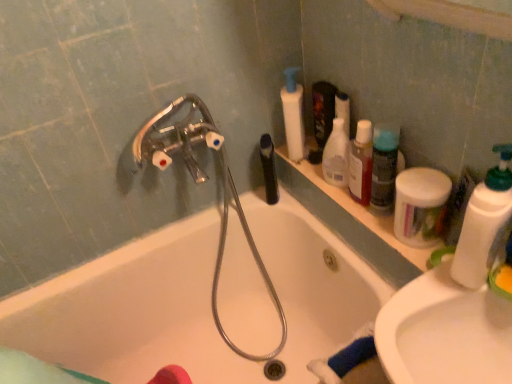
Question: Considering the relative sizes of white plastic pump bottle at upper center, which is the first cleaning product in back-to-front order, and white matte jar at upper right, the fourth cleaning product viewed from the back, in the image provided, is white plastic pump bottle at upper center, which is the first cleaning product in back-to-front order, wider than white matte jar at upper right, the fourth cleaning product viewed from the back,?

Choices:
 (A) no
 (B) yes

Answer: (A)

Question: Does white plastic pump bottle at upper center, which is the first cleaning product in back-to-front order, have a smaller size compared to white matte jar at upper right, which is the second cleaning product in front-to-back order?

Choices:
 (A) yes
 (B) no

Answer: (A)

Question: Is white plastic pump bottle at upper center, which is the first cleaning product in back-to-front order, to the left of white matte jar at upper right, the fourth cleaning product viewed from the back, from the viewer's perspective?

Choices:
 (A) no
 (B) yes

Answer: (B)

Question: Is white plastic pump bottle at upper center, which is the first cleaning product in back-to-front order, not inside white matte jar at upper right, which is the second cleaning product in front-to-back order?

Choices:
 (A) yes
 (B) no

Answer: (A)

Question: Is white plastic pump bottle at upper center, which is the 5th cleaning product in front-to-back order, positioned far away from white matte jar at upper right, the fourth cleaning product viewed from the back?

Choices:
 (A) no
 (B) yes

Answer: (A)

Question: Can you confirm if white plastic pump bottle at upper center, which is the 5th cleaning product in front-to-back order, is bigger than white matte jar at upper right, the fourth cleaning product viewed from the back?

Choices:
 (A) yes
 (B) no

Answer: (B)

Question: Considering the relative positions of white plastic bottle at right, the 1th cleaning product in the front-to-back sequence, and translucent plastic bottle at upper right, the third cleaning product in the front-to-back sequence, in the image provided, is white plastic bottle at right, the 1th cleaning product in the front-to-back sequence, in front of translucent plastic bottle at upper right, the third cleaning product in the front-to-back sequence,?

Choices:
 (A) no
 (B) yes

Answer: (B)

Question: Is white plastic bottle at right, the 1th cleaning product in the front-to-back sequence, placed right next to translucent plastic bottle at upper right, the third cleaning product positioned from the back?

Choices:
 (A) no
 (B) yes

Answer: (A)

Question: From a real-world perspective, is white plastic bottle at right, the 5th cleaning product positioned from the back, on translucent plastic bottle at upper right, the third cleaning product positioned from the back?

Choices:
 (A) yes
 (B) no

Answer: (A)

Question: Is white plastic bottle at right, the 5th cleaning product positioned from the back, at the left side of translucent plastic bottle at upper right, the third cleaning product positioned from the back?

Choices:
 (A) no
 (B) yes

Answer: (A)

Question: From a real-world perspective, is white plastic bottle at right, the 5th cleaning product positioned from the back, located beneath translucent plastic bottle at upper right, the third cleaning product in the front-to-back sequence?

Choices:
 (A) yes
 (B) no

Answer: (B)

Question: Could you tell me if white plastic bottle at right, the 1th cleaning product in the front-to-back sequence, is facing translucent plastic bottle at upper right, the third cleaning product positioned from the back?

Choices:
 (A) no
 (B) yes

Answer: (A)

Question: From the image's perspective, is white plastic bottle at right, the 1th cleaning product in the front-to-back sequence, beneath white glossy sink at lower right?

Choices:
 (A) yes
 (B) no

Answer: (B)